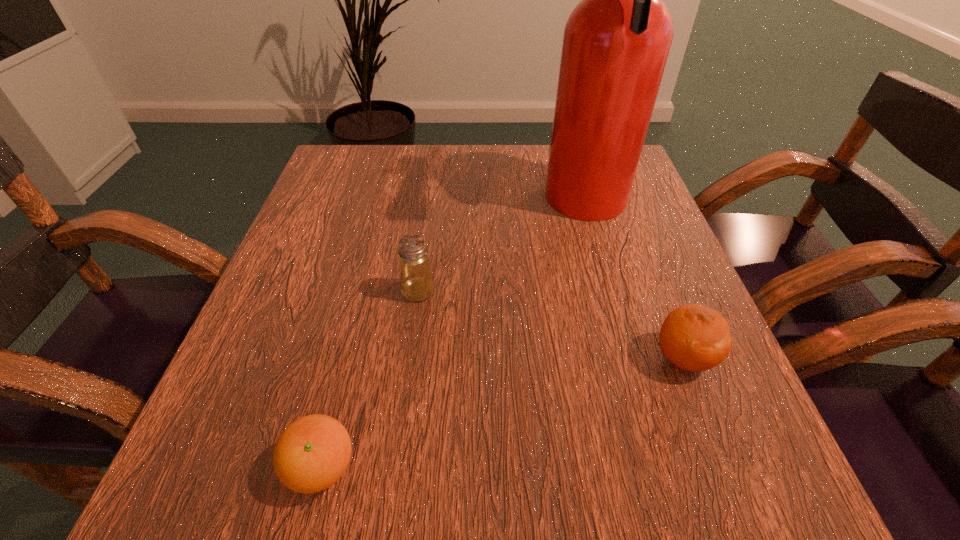
At what (x,y) coordinates should I click in order to perform the action: click on free space between the shorter orange and the right orange. Please return your answer as a coordinate pair (x, y). The height and width of the screenshot is (540, 960). Looking at the image, I should click on (502, 413).

This screenshot has height=540, width=960. In order to click on empty space between the second object from left to right and the third farthest object in this screenshot , I will do coord(550,325).

You are a GUI agent. You are given a task and a screenshot of the screen. Output one action in this format:
    pyautogui.click(x=<x>, y=<y>)
    Task: Click on the free area in between the third farthest object and the fire extinguisher
    This screenshot has height=540, width=960.
    Given the screenshot: What is the action you would take?
    pyautogui.click(x=635, y=282)

Identify the location of vacant area between the taller orange and the saltshaker. (550, 325).

In order to click on object that ranks as the third closest to the saltshaker in this screenshot , I will do `click(695, 338)`.

The height and width of the screenshot is (540, 960). What are the coordinates of `object that stands as the second closest to the second object from left to right` in the screenshot? It's located at (312, 453).

Locate an element on the screen. The image size is (960, 540). blank area in the image that satisfies the following two spatial constraints: 1. on the front side of the farther orange; 2. on the right side of the fire extinguisher is located at coordinates (630, 358).

What are the coordinates of `free space that satisfies the following two spatial constraints: 1. on the back side of the shortest object; 2. on the right side of the farther orange` in the screenshot? It's located at (349, 358).